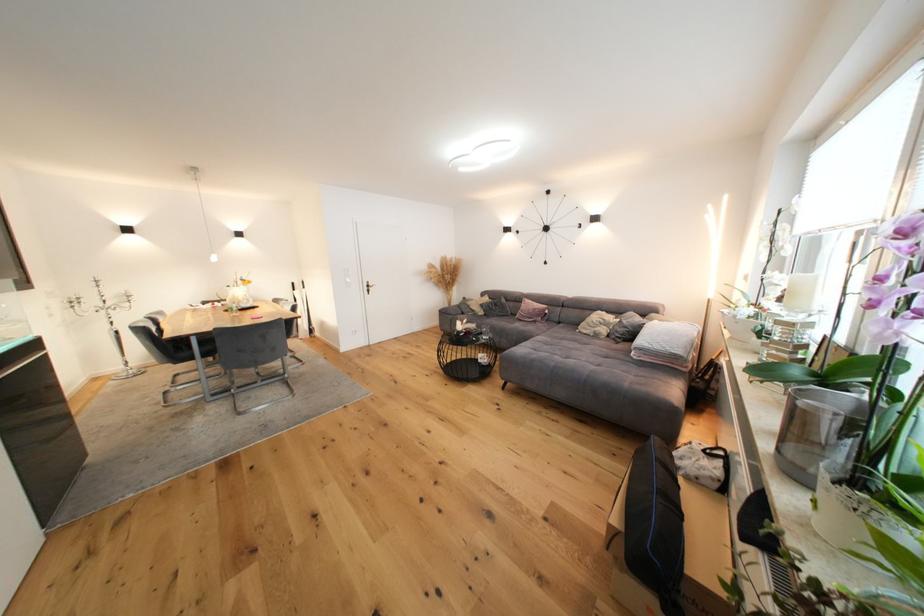
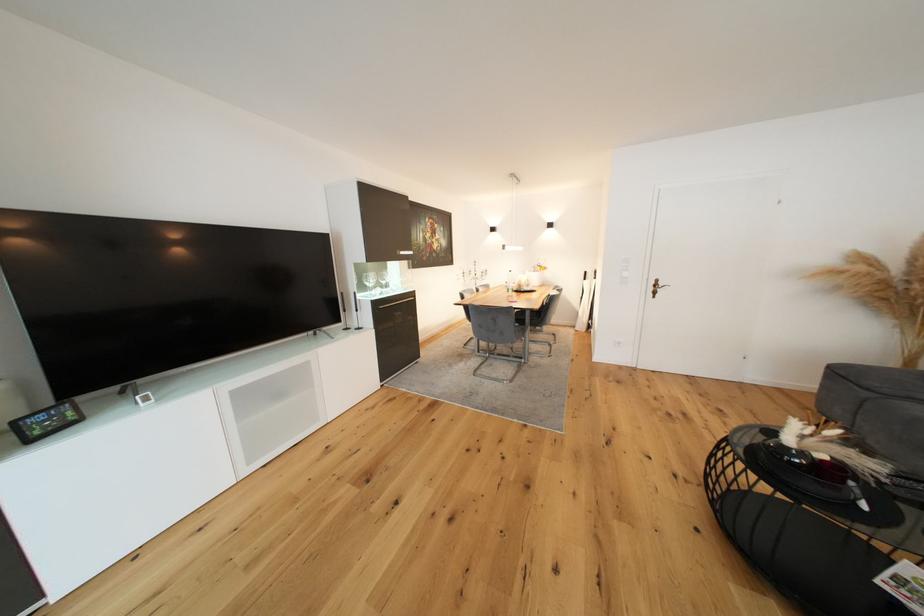
In the second image, find the point that corresponds to point 466,334 in the first image.

(792, 450)